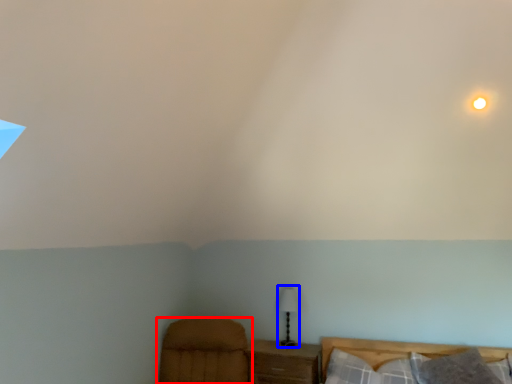
Question: Which of the following is the farthest to the observer, furniture (highlighted by a red box) or table lamp (highlighted by a blue box)?

Choices:
 (A) furniture
 (B) table lamp

Answer: (B)